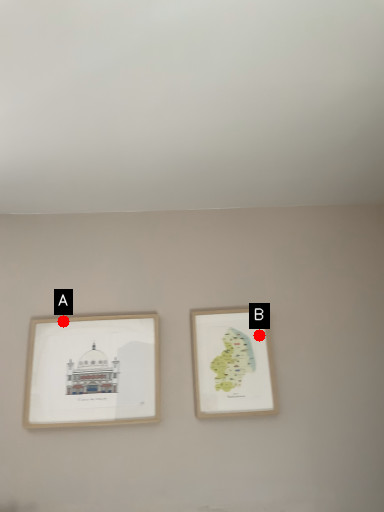
Question: Two points are circled on the image, labeled by A and B beside each circle. Among these points, which one is nearest to the camera?

Choices:
 (A) A is closer
 (B) B is closer

Answer: (A)